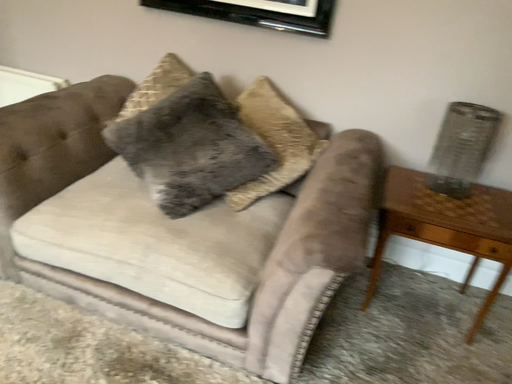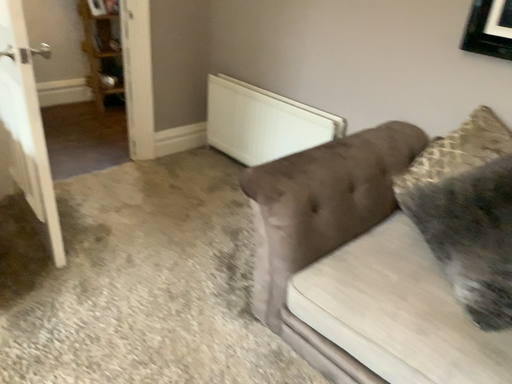
Question: Which way did the camera rotate in the video?

Choices:
 (A) rotated left
 (B) rotated right

Answer: (A)